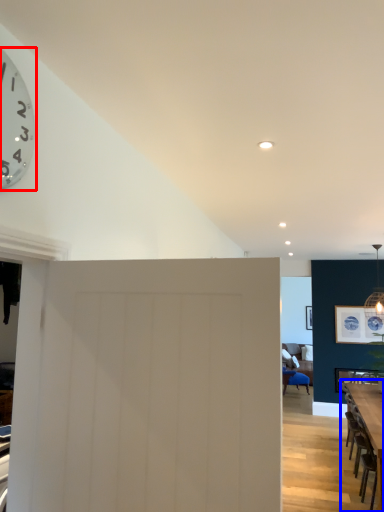
Question: Which object is closer to the camera taking this photo, wall clock (highlighted by a red box) or table (highlighted by a blue box)?

Choices:
 (A) wall clock
 (B) table

Answer: (A)